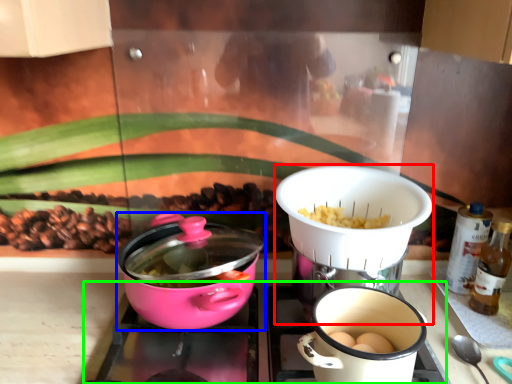
Question: Estimate the real-world distances between objects in this image. Which object is farther from kitchen appliance (highlighted by a red box), kitchen appliance (highlighted by a blue box) or gas stove (highlighted by a green box)?

Choices:
 (A) kitchen appliance
 (B) gas stove

Answer: (A)